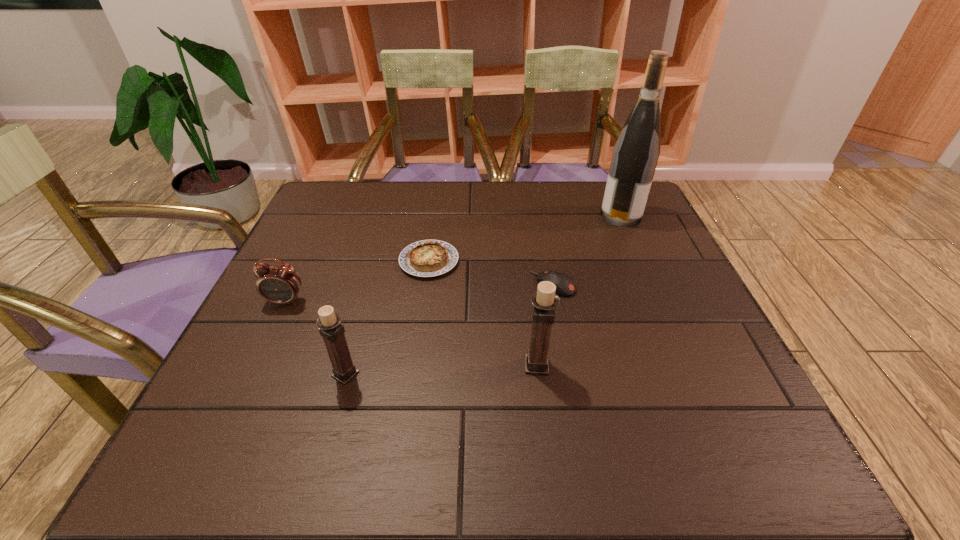
Given the evenly spaced candle holders in the image, where should an extra candle holder be added on the right to preserve the spacing? Please point to a vacant space. Please provide its 2D coordinates. Your answer should be formatted as a tuple, i.e. [(x, y)], where the tuple contains the x and y coordinates of a point satisfying the conditions above.

[(721, 357)]